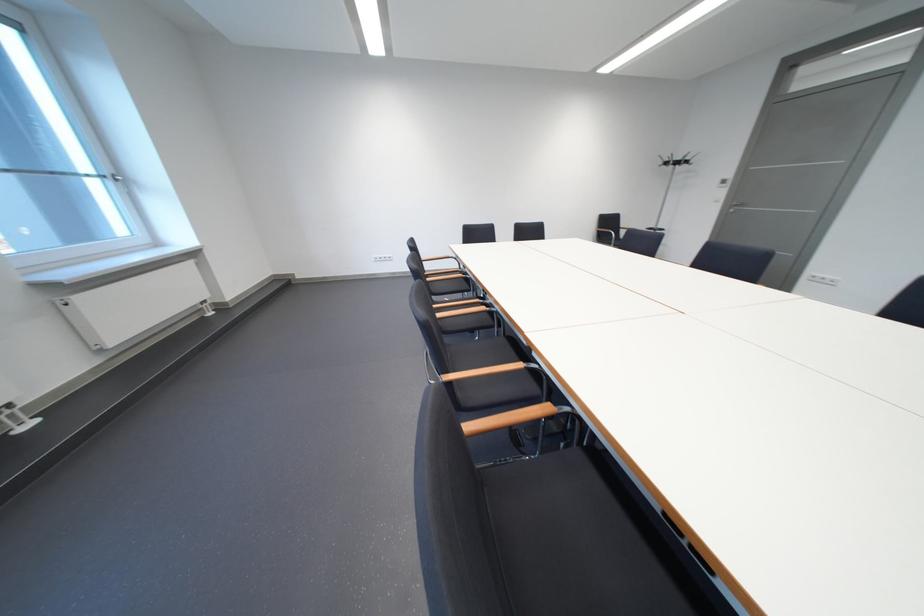
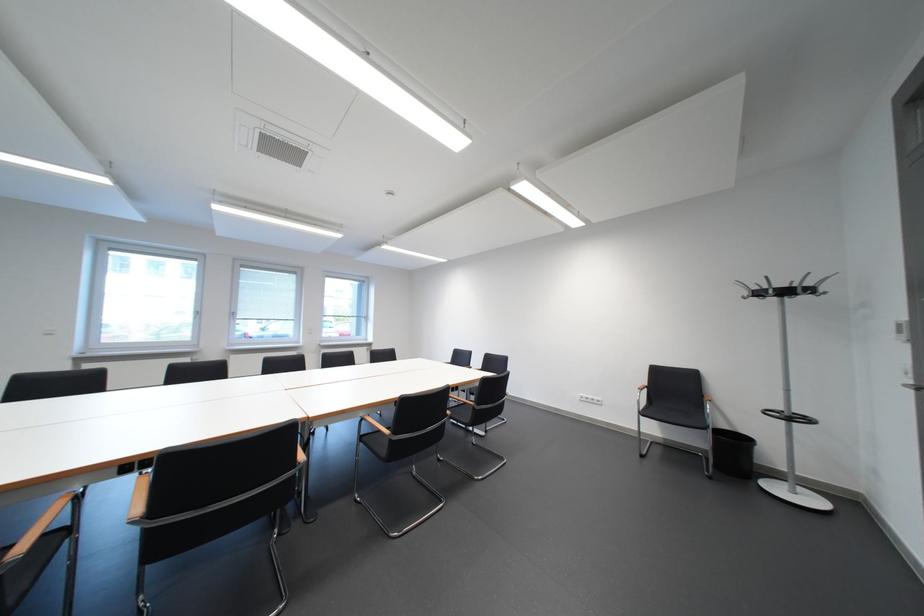
The point at (700, 163) is marked in the first image. Where is the corresponding point in the second image?

(823, 292)